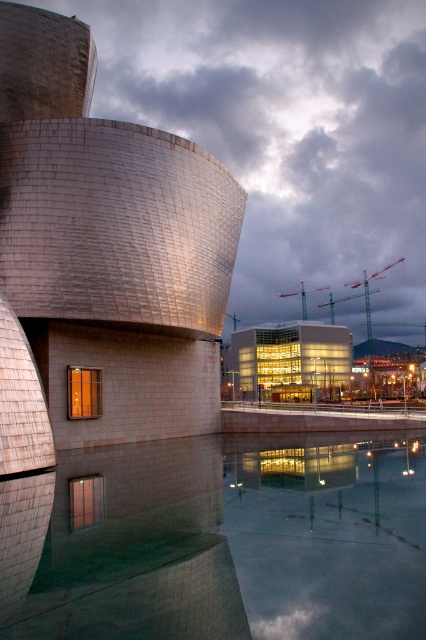
Question: Is transparent glass building at center positioned in front of green metallic cranes at upper center?

Choices:
 (A) yes
 (B) no

Answer: (A)

Question: Estimate the real-world distances between objects in this image. Which object is farther from the reflective glass water at lower center?

Choices:
 (A) glass modern building at center
 (B) transparent glass building at center

Answer: (A)

Question: Among these objects, which one is farthest from the camera?

Choices:
 (A) reflective glass water at lower center
 (B) glass modern building at center
 (C) green metallic cranes at upper center

Answer: (C)

Question: Does glass modern building at center appear over transparent glass building at center?

Choices:
 (A) no
 (B) yes

Answer: (B)

Question: Does transparent glass building at center lie behind green metallic cranes at upper center?

Choices:
 (A) no
 (B) yes

Answer: (A)

Question: Which of the following is the closest to the observer?

Choices:
 (A) reflective glass water at lower center
 (B) glass modern building at center
 (C) transparent glass building at center
 (D) green metallic cranes at upper center

Answer: (A)